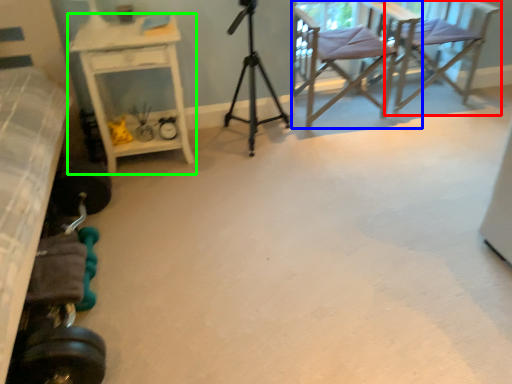
Question: Which object is the farthest from chair (highlighted by a red box)? Choose among these: chair (highlighted by a blue box) or desk (highlighted by a green box).

Choices:
 (A) chair
 (B) desk

Answer: (B)